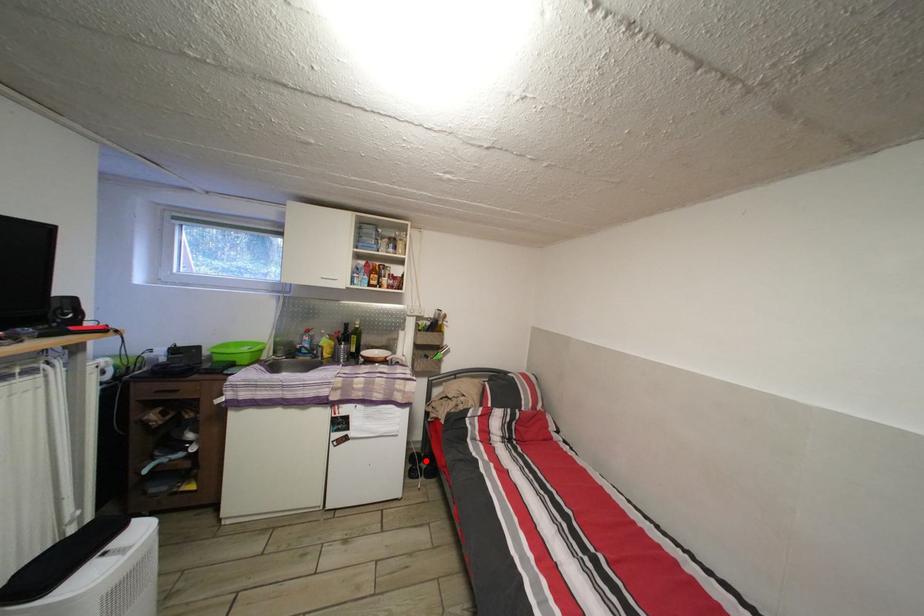
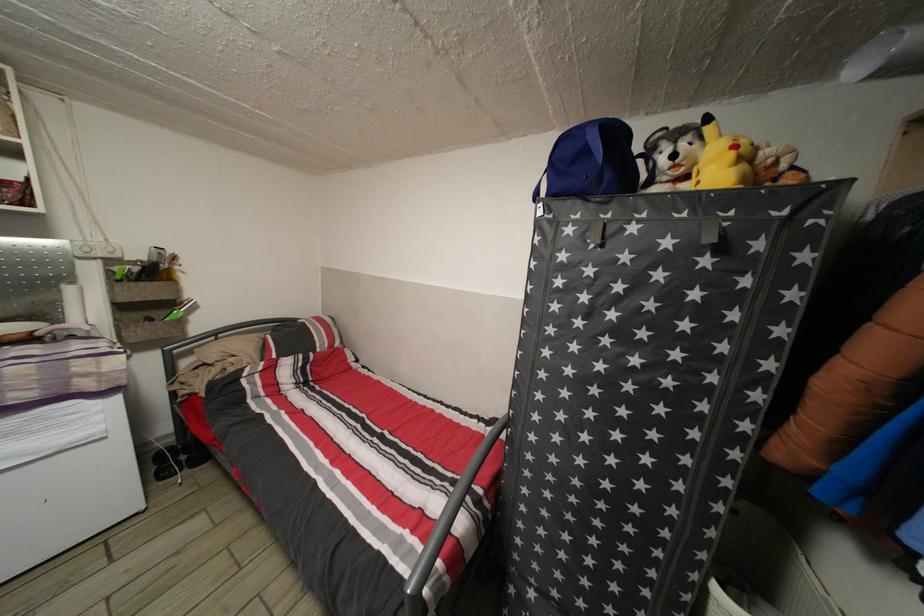
Question: I am providing you with two images of the same scene from different viewpoints. A red point is shown in image1. For the corresponding object point in image2, is it positioned nearer or farther from the camera?

Choices:
 (A) Nearer
 (B) Farther

Answer: (A)